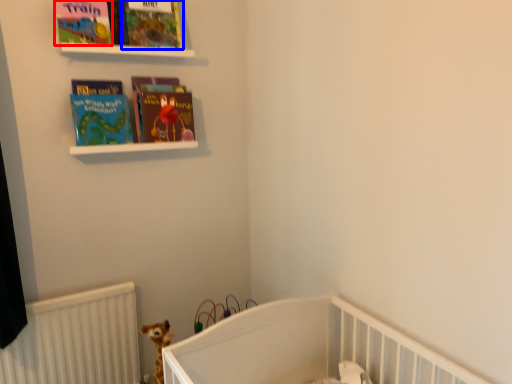
Question: Which object appears farthest to the camera in this image, book cover (highlighted by a red box) or book cover (highlighted by a blue box)?

Choices:
 (A) book cover
 (B) book cover

Answer: (B)